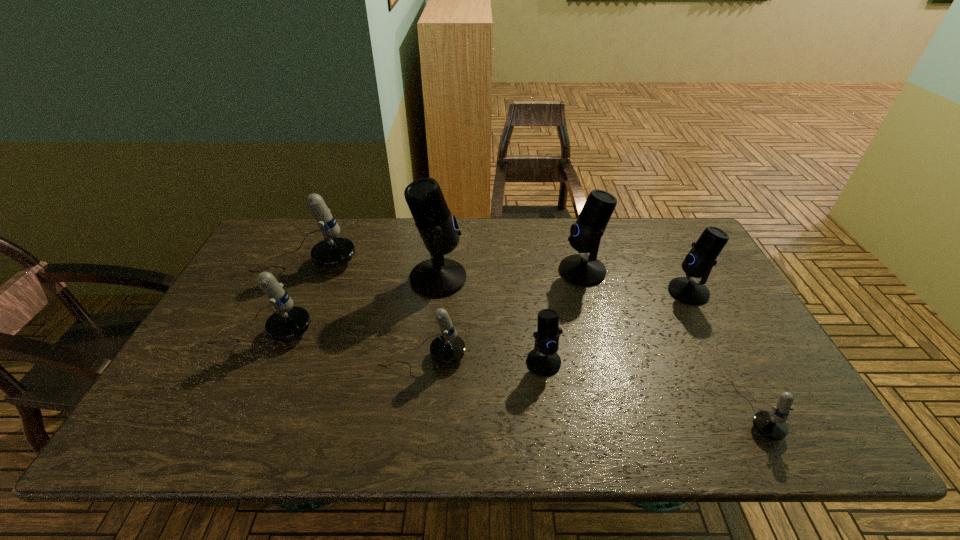
Identify the location of the leftmost black microphone. This screenshot has width=960, height=540. (437, 277).

This screenshot has height=540, width=960. Identify the location of the tallest object. (437, 277).

Where is `the third microphone from right to left`? the third microphone from right to left is located at coordinates (582, 269).

The image size is (960, 540). In order to click on the third smallest black microphone in this screenshot , I will do `click(582, 269)`.

The image size is (960, 540). Find the location of `the biggest white microphone`. the biggest white microphone is located at coordinates (334, 251).

The image size is (960, 540). In order to click on the second smallest black microphone in this screenshot , I will do `click(701, 258)`.

At what (x,y) coordinates should I click in order to perform the action: click on the third smallest white microphone. Please return your answer as a coordinate pair (x, y). This screenshot has height=540, width=960. Looking at the image, I should click on (288, 322).

The width and height of the screenshot is (960, 540). Identify the location of the second smallest white microphone. (448, 348).

Where is `the nearest black microphone`? the nearest black microphone is located at coordinates (543, 360).

At what (x,y) coordinates should I click in order to perform the action: click on the fifth microphone from left to right. Please return your answer as a coordinate pair (x, y). Looking at the image, I should click on (543, 360).